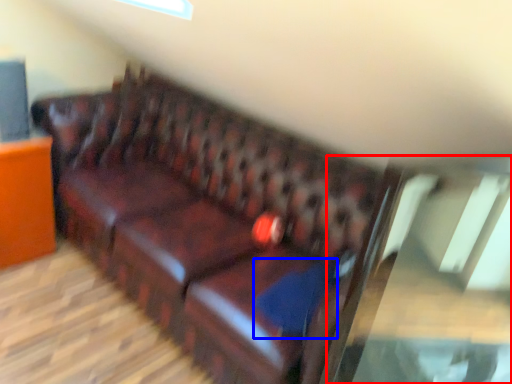
Question: Which object appears farthest to the camera in this image, glass table (highlighted by a red box) or pillow (highlighted by a blue box)?

Choices:
 (A) glass table
 (B) pillow

Answer: (B)